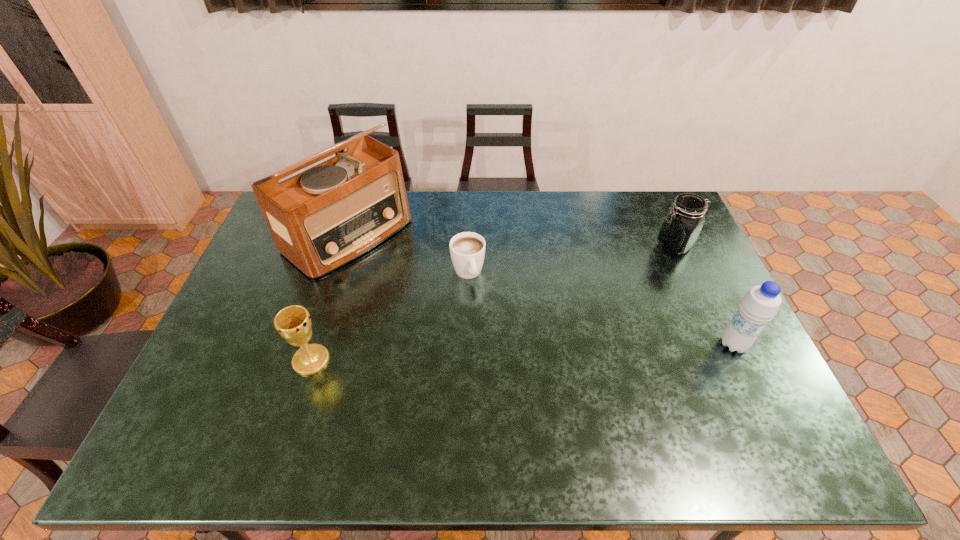
This screenshot has width=960, height=540. What are the coordinates of `free space located on the lid of the jar` in the screenshot? It's located at (622, 286).

This screenshot has height=540, width=960. In order to click on vacant region located with the handle on the side of the cappuccino in this screenshot , I will do `click(485, 323)`.

Locate an element on the screen. This screenshot has width=960, height=540. free region located with the handle on the side of the cappuccino is located at coordinates (487, 329).

Identify the location of free space located with the handle on the side of the cappuccino. (498, 364).

Where is `vacant space situated 0.310m on the front panel of the tallest object`? The height and width of the screenshot is (540, 960). vacant space situated 0.310m on the front panel of the tallest object is located at coordinates (456, 314).

Where is `free region located on the front panel of the tallest object`? free region located on the front panel of the tallest object is located at coordinates (446, 307).

Where is `free spot located on the front panel of the tallest object`? The height and width of the screenshot is (540, 960). free spot located on the front panel of the tallest object is located at coordinates (410, 281).

At what (x,y) coordinates should I click in order to perform the action: click on object that is positioned at the far edge. Please return your answer as a coordinate pair (x, y). Looking at the image, I should click on (324, 217).

This screenshot has height=540, width=960. I want to click on object that is at the left edge, so click(x=324, y=217).

Find the location of a particular element. This screenshot has height=540, width=960. water bottle that is at the right edge is located at coordinates (761, 303).